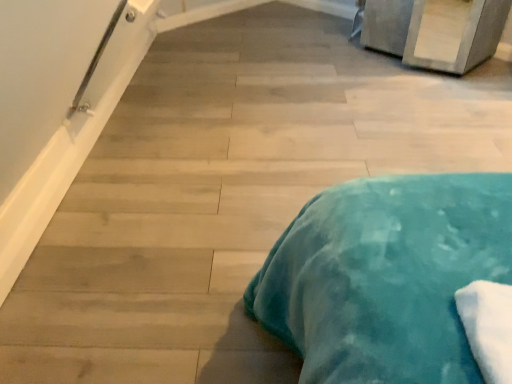
Image resolution: width=512 pixels, height=384 pixels. What do you see at coordinates (424, 23) in the screenshot?
I see `metallic gray table at upper right` at bounding box center [424, 23].

What is the approximate height of metallic gray table at upper right?

metallic gray table at upper right is 10.86 centimeters in height.

The width and height of the screenshot is (512, 384). Find the location of `metallic gray table at upper right`. metallic gray table at upper right is located at coordinates (424, 23).

Locate an element on the screen. The width and height of the screenshot is (512, 384). metallic gray table at upper right is located at coordinates (424, 23).